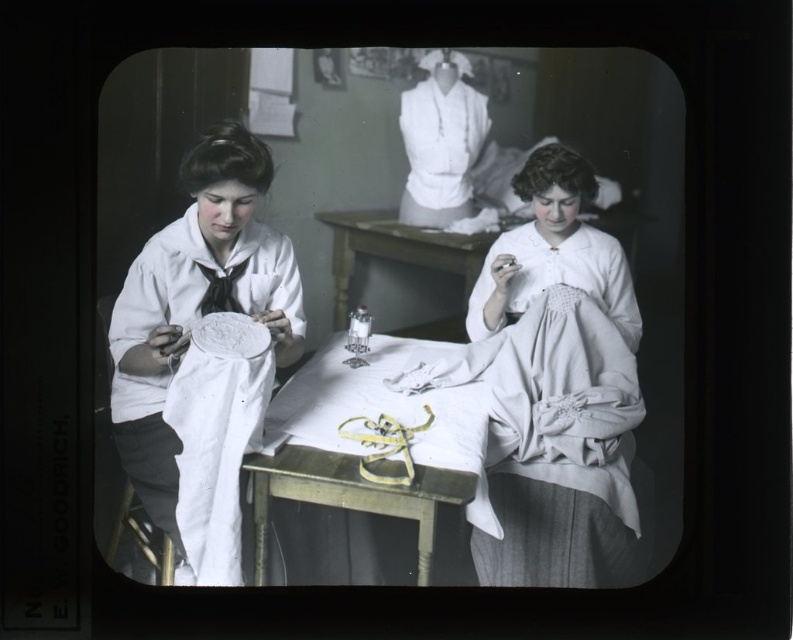
You are organizing a historical exhibit and need to place a label next to the wooden table at center and the white cotton blouse at upper center. Which object should you place the label closer to if the label must be near the larger item?

The wooden table at center is larger in size than the white cotton blouse at upper center, so the label should be placed closer to the wooden table at center.

You are an interior designer planning to place a large decorative vase on the wooden table at center. Considering the size of the table and the white matte fabric at left, will the vase fit on the table without overlapping the fabric?

The wooden table at center is smaller than the white matte fabric at left. Since the table is smaller, placing a large decorative vase might cause it to overlap with the fabric unless the vase is positioned carefully within the table area.

What is located at the coordinates point (366, 481) in the image?

The wooden table at center is located at point (366, 481).